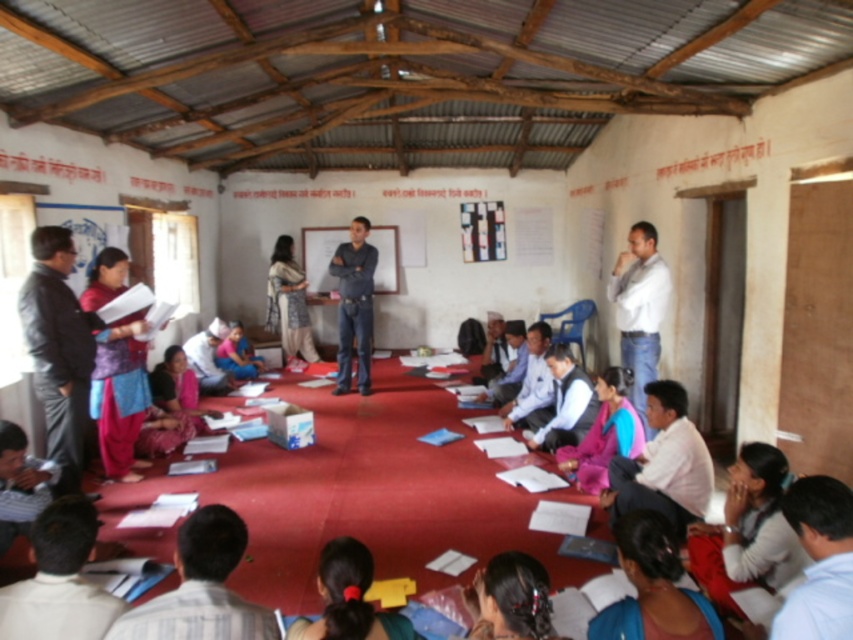
You are a photographer trying to capture a candid shot of the dark blue jeans at center without including the white shirt at upper right in the frame. Based on their positions, is this possible?

The white shirt at upper right is positioned on the right side of dark blue jeans at center, so if you position yourself to the left of the dark blue jeans at center, you can capture the shot without including the white shirt at upper right.

You are a photographer trying to capture a candid shot of the group in the classroom. You notice the white shirt at upper right and dark blue jeans at center. Which clothing item should you focus on to ensure it fits entirely within your camera frame if your current framing is limited to the height of the shorter object?

The white shirt at upper right is shorter than the dark blue jeans at center, so you should focus on the white shirt at upper right to ensure it fits entirely within your camera frame since it is shorter.

You are standing at the origin point of the coordinate system in the image. You want to move towards the white shirt at upper right. Which direction should you move first? Please answer with either North, South, East, or West.

The white shirt at upper right is located at coordinate point (639,308). Since the y coordinate is 0.750, which is higher than the origin point at 0, you should move North first to reach it.